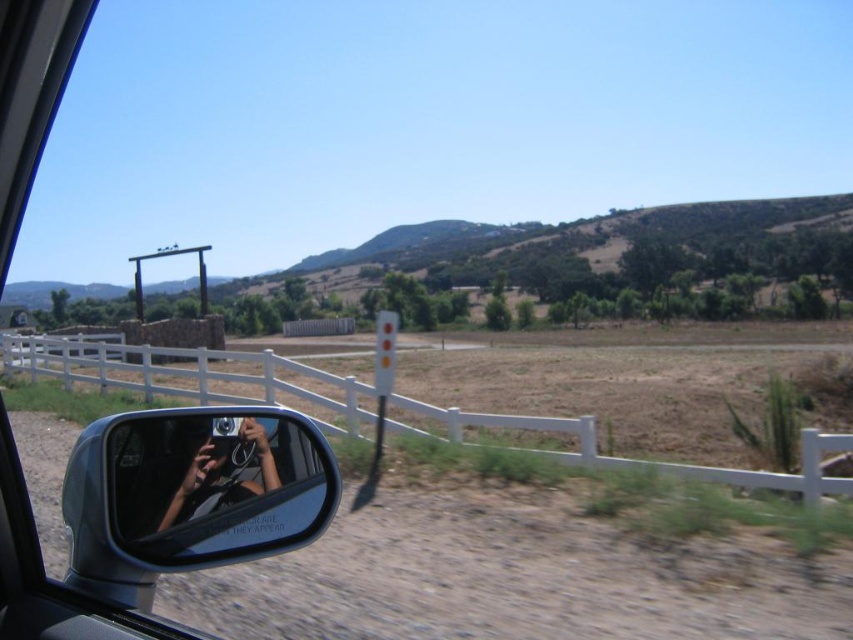
Between point (125, 500) and point (132, 349), which one is positioned in front?

Positioned in front is point (125, 500).

Which is more to the right, clear glass mirror at lower left or white wooden fence at lower right?

clear glass mirror at lower left is more to the right.

Between point (178, 545) and point (537, 419), which one is positioned in front?

Point (178, 545) is in front.

Where is `clear glass mirror at lower left`? clear glass mirror at lower left is located at coordinates (216, 484).

Who is more forward, (572, 461) or (181, 502)?

Point (181, 502)

Based on the photo, is the position of white wooden fence at lower right more distant than that of matte black camera at lower center?

Yes, it is behind matte black camera at lower center.

Identify the location of white wooden fence at lower right. coord(184,372).

Is clear glass mirror at lower left wider than matte black camera at lower center?

In fact, clear glass mirror at lower left might be narrower than matte black camera at lower center.

Does clear glass mirror at lower left have a larger size compared to matte black camera at lower center?

No, clear glass mirror at lower left is not bigger than matte black camera at lower center.

Who is more distant from viewer, [166,428] or [242,497]?

The point [242,497] is more distant.

Locate an element on the screen. clear glass mirror at lower left is located at coordinates (216, 484).